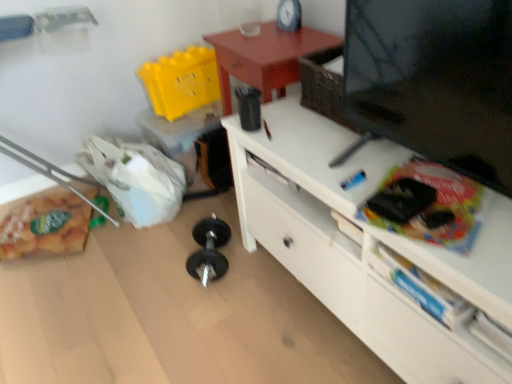
Image resolution: width=512 pixels, height=384 pixels. In order to click on free space in front of translucent plastic bag at lower left in this screenshot , I will do `click(58, 294)`.